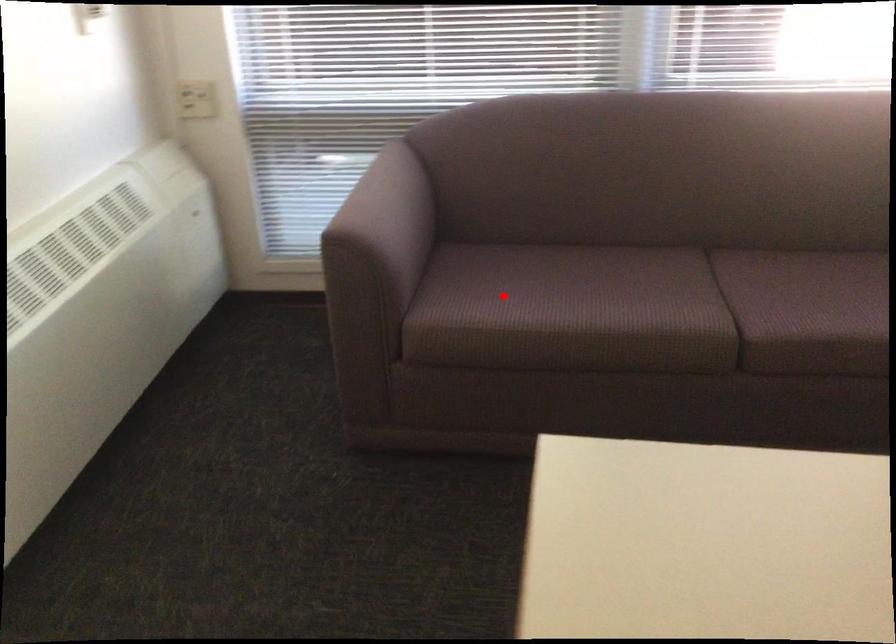
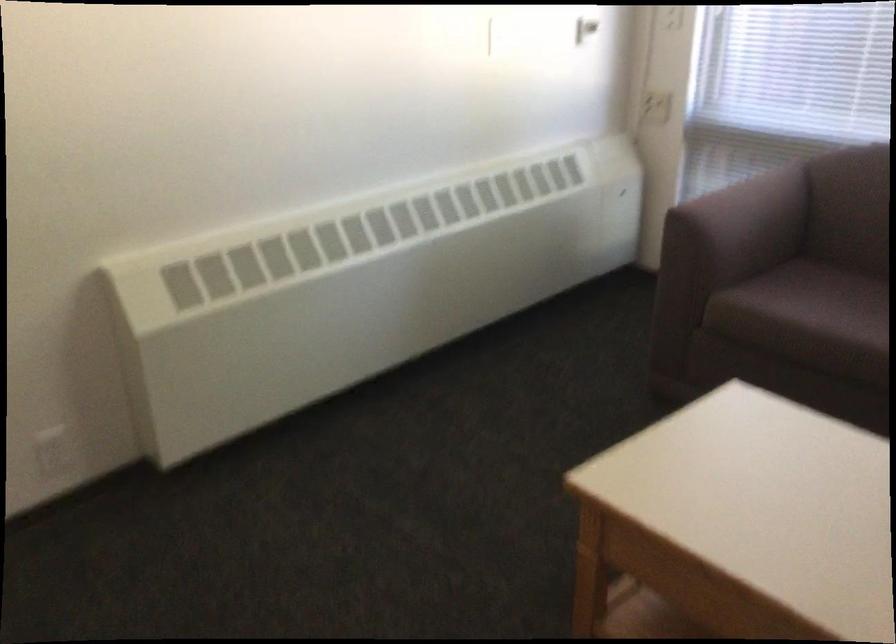
Question: A red point is marked in image1. In image2, is the corresponding 3D point closer to the camera or farther? Reply with the corresponding letter.

Choices:
 (A) The corresponding 3D point is closer.
 (B) The corresponding 3D point is farther.

Answer: (B)